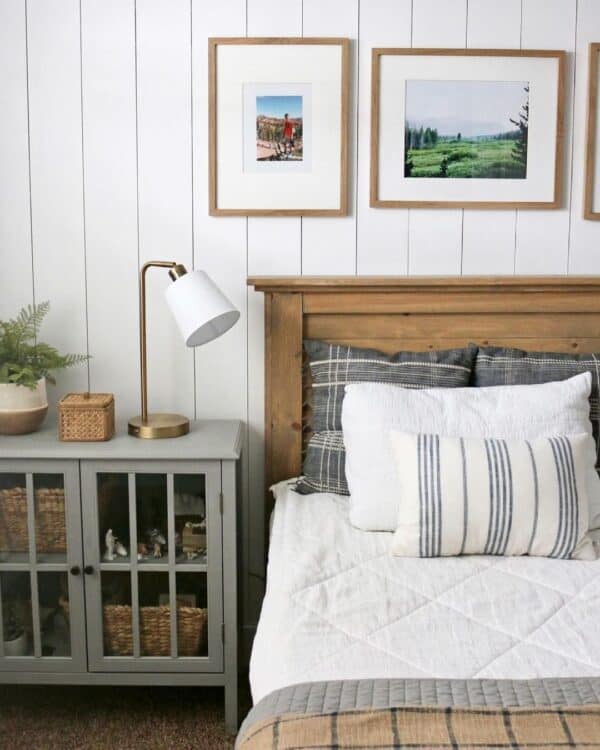
What are the coordinates of `headboard` in the screenshot? It's located at pyautogui.click(x=436, y=322).